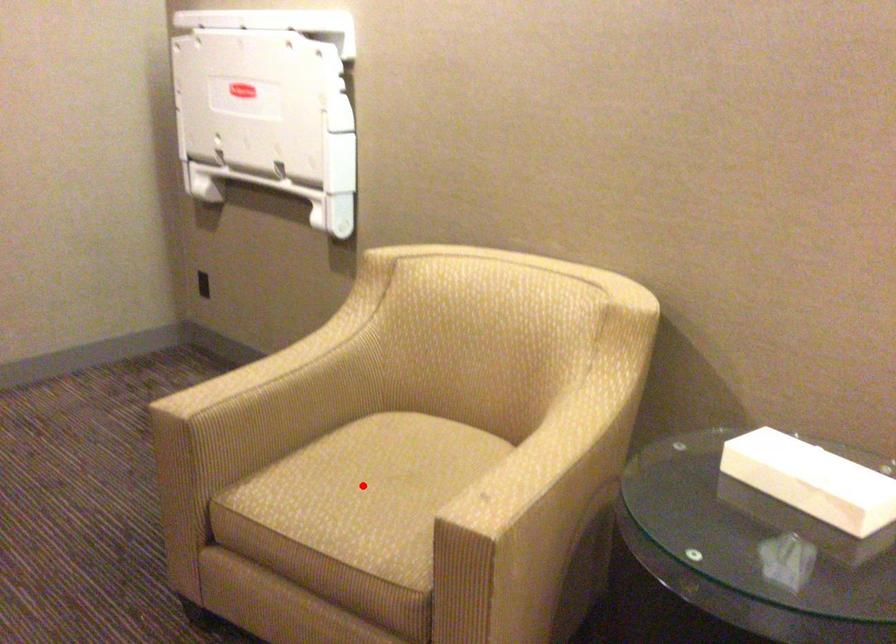
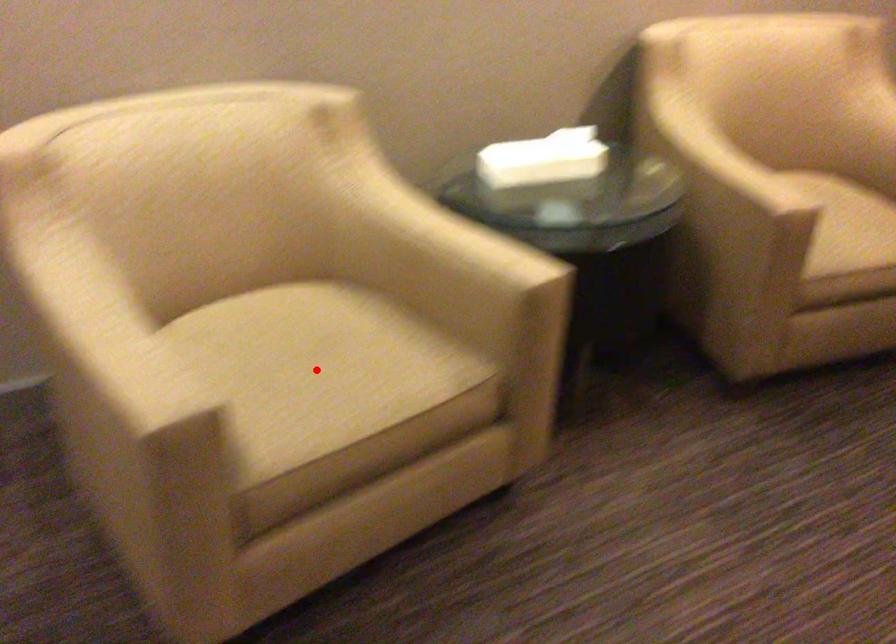
I am providing you with two images of the same scene from different viewpoints. A red point is marked on the first image and another point is marked on the second image. Are the points marked in image1 and image2 representing the same 3D position?

Yes